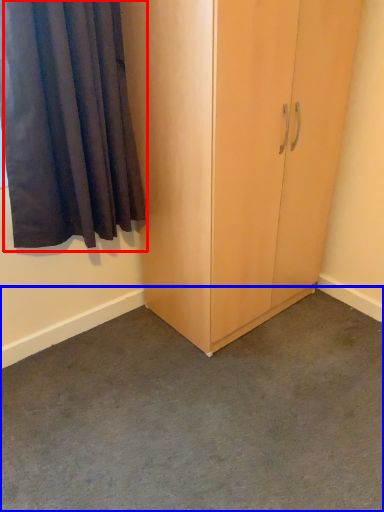
Question: Which object is further to the camera taking this photo, curtain (highlighted by a red box) or concrete (highlighted by a blue box)?

Choices:
 (A) curtain
 (B) concrete

Answer: (A)